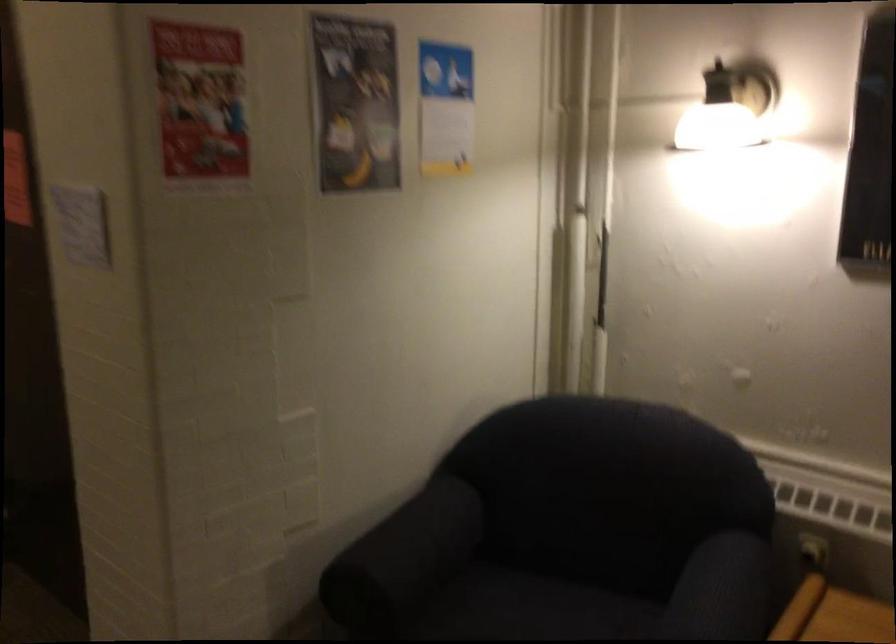
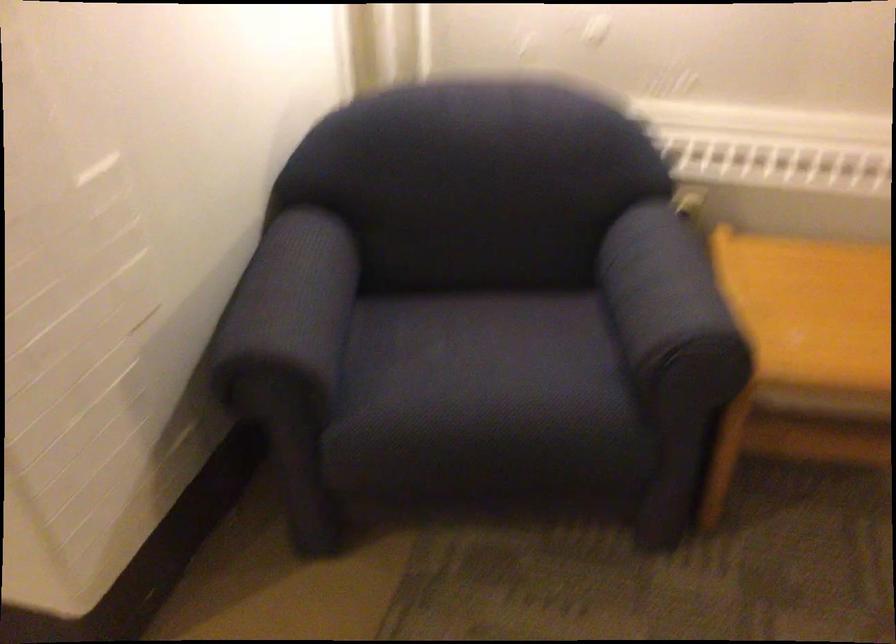
First-person continuous shooting, in which direction is the camera rotating?

The camera's rotation is toward right-down.